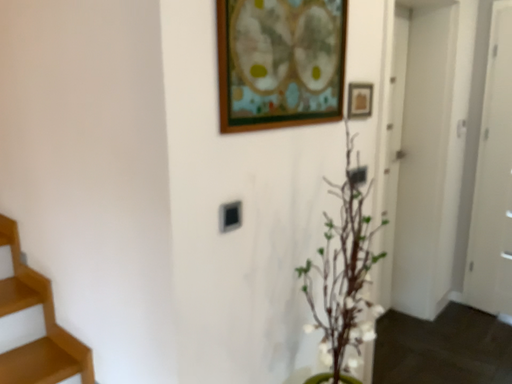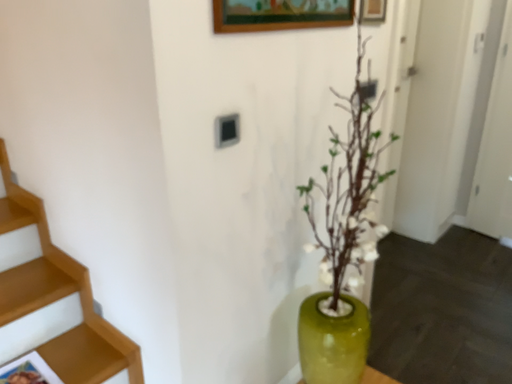
Question: Which way did the camera rotate in the video?

Choices:
 (A) rotated downward
 (B) rotated upward

Answer: (A)